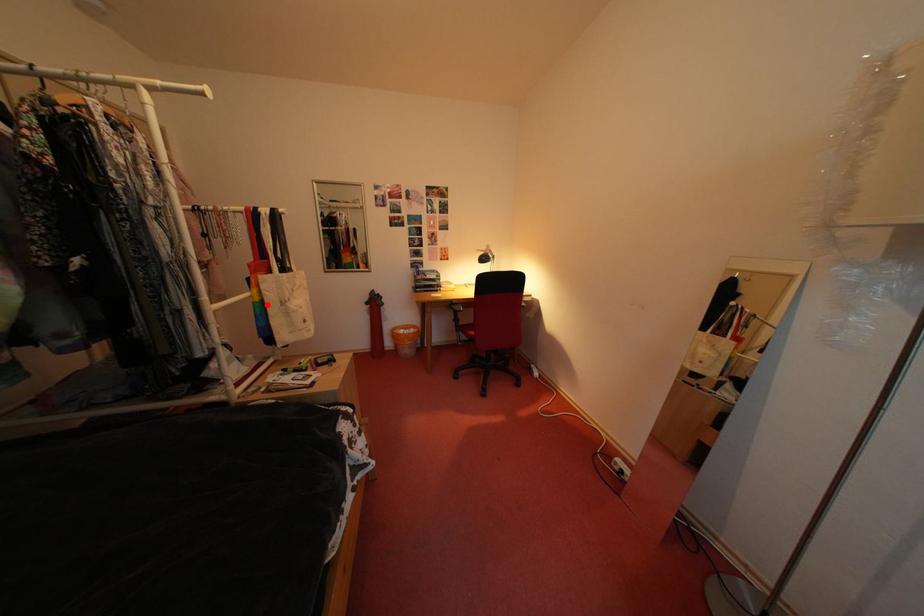
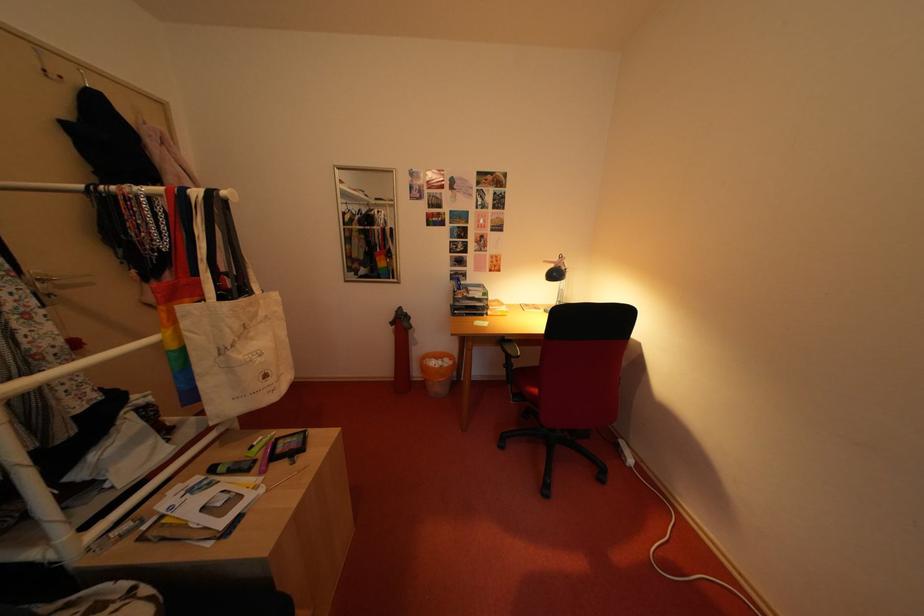
In the second image, find the point that corresponds to the highlighted location in the first image.

(184, 352)